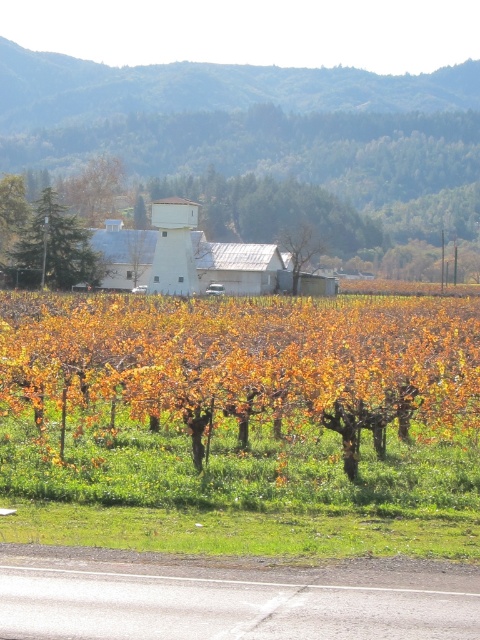
Question: Is green textured pine tree at upper left further to camera compared to green leafy tree at upper center?

Choices:
 (A) no
 (B) yes

Answer: (A)

Question: Which point is closer to the camera taking this photo?

Choices:
 (A) (0, 234)
 (B) (74, 198)
 (C) (317, 250)
 (D) (21, 240)

Answer: (D)

Question: Is yellow-green leafy vines at center to the right of green leafy tree at left from the viewer's perspective?

Choices:
 (A) no
 (B) yes

Answer: (B)

Question: Which of the following is the closest to the observer?

Choices:
 (A) yellow-green leafy vines at center
 (B) green textured pine tree at upper left
 (C) green leafy tree at center

Answer: (A)

Question: Which object is positioned farthest from the green leafy tree at upper center?

Choices:
 (A) green leafy tree at left
 (B) green leafy tree at center

Answer: (A)

Question: Can you confirm if yellow-green leafy vines at center is bigger than green leafy tree at center?

Choices:
 (A) no
 (B) yes

Answer: (B)